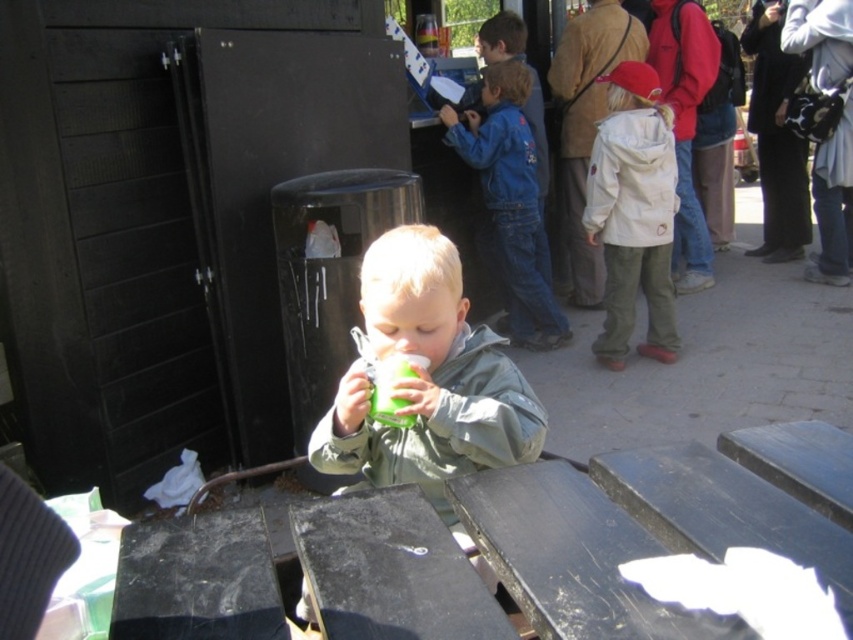
Which of these two, white matte jacket at right or blue denim jacket at center, stands shorter?

white matte jacket at right is shorter.

Which of these two, white matte jacket at right or blue denim jacket at center, stands taller?

With more height is blue denim jacket at center.

The height and width of the screenshot is (640, 853). What do you see at coordinates (633, 212) in the screenshot?
I see `white matte jacket at right` at bounding box center [633, 212].

Image resolution: width=853 pixels, height=640 pixels. I want to click on white matte jacket at right, so click(633, 212).

Measure the distance between green matte cup at center and camera.

green matte cup at center and camera are 4.36 feet apart.

Based on the photo, who is more forward, (x=374, y=298) or (x=540, y=284)?

Point (x=374, y=298) is in front.

Is point (509, 380) in front of point (509, 97)?

Yes, point (509, 380) is closer to viewer.

Image resolution: width=853 pixels, height=640 pixels. Identify the location of green matte cup at center. (427, 380).

Does green matte cup at center have a smaller size compared to white matte jacket at right?

Indeed, green matte cup at center has a smaller size compared to white matte jacket at right.

Looking at this image, how distant is green matte cup at center from white matte jacket at right?

They are 7.61 feet apart.

This screenshot has width=853, height=640. Find the location of `green matte cup at center`. green matte cup at center is located at coordinates [x=427, y=380].